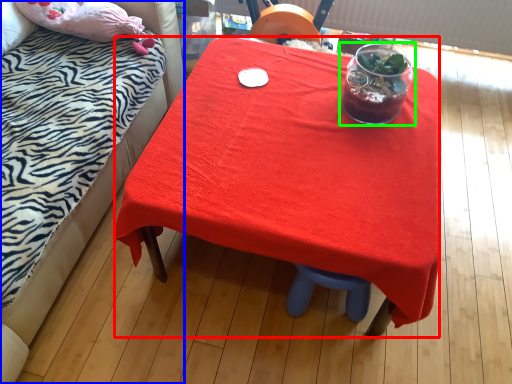
Question: Estimate the real-world distances between objects in this image. Which object is closer to desk (highlighted by a red box), bed (highlighted by a blue box) or tableware (highlighted by a green box)?

Choices:
 (A) bed
 (B) tableware

Answer: (B)